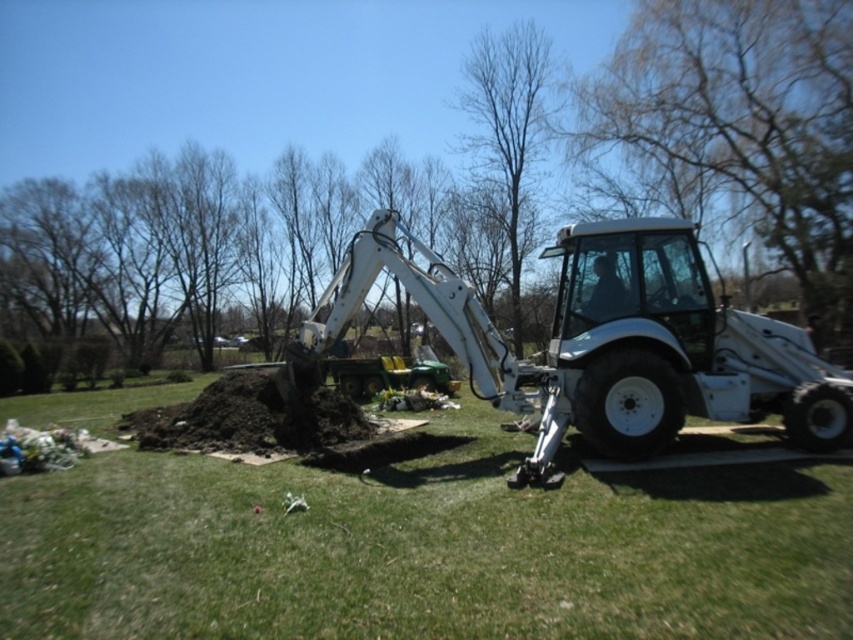
You are standing in the outdoor scene and want to take a photo of the brown leafless tree at center. The camera you have can focus on objects up to 10 meters away. Will the tree be in focus?

The brown leafless tree at center is 7.22 meters from viewer, which is within the camera focus range of up to 10 meters. Therefore, the tree will be in focus.

You are standing in front of the tractor and want to place a small flag exactly halfway between point [631,301] and point [831,326]. Since you can only estimate distances visually, will the flag be closer to the tractor or further away from it compared to the original points?

The flag placed halfway between point [631,301] and point [831,326] will be further away from the tractor than both points because point [631,301] is closer to the camera than point [831,326]. Since the tractor is on the right side facing left, the midpoint would lie along the line connecting them, but since one point is closer and the other is farther, the average position would be closer to the farther point, making it overall further from the tractor.

You are a photographer standing in the scene and want to take a picture of the green grass at center and the white matte tractor at center. Which object will appear larger in your photo?

The green grass at center will appear larger in the photo because it is closer to the viewer than the white matte tractor at center.